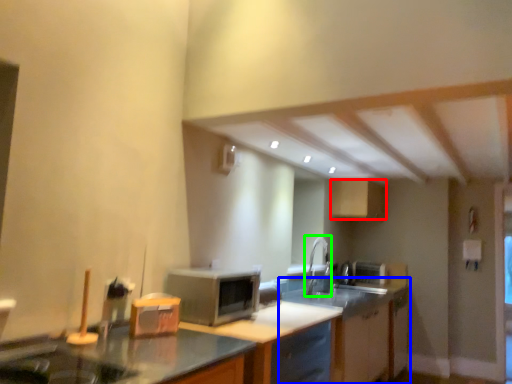
Question: Estimate the real-world distances between objects in this image. Which object is closer to cabinetry (highlighted by a red box), cabinetry (highlighted by a blue box) or faucet (highlighted by a green box)?

Choices:
 (A) cabinetry
 (B) faucet

Answer: (B)